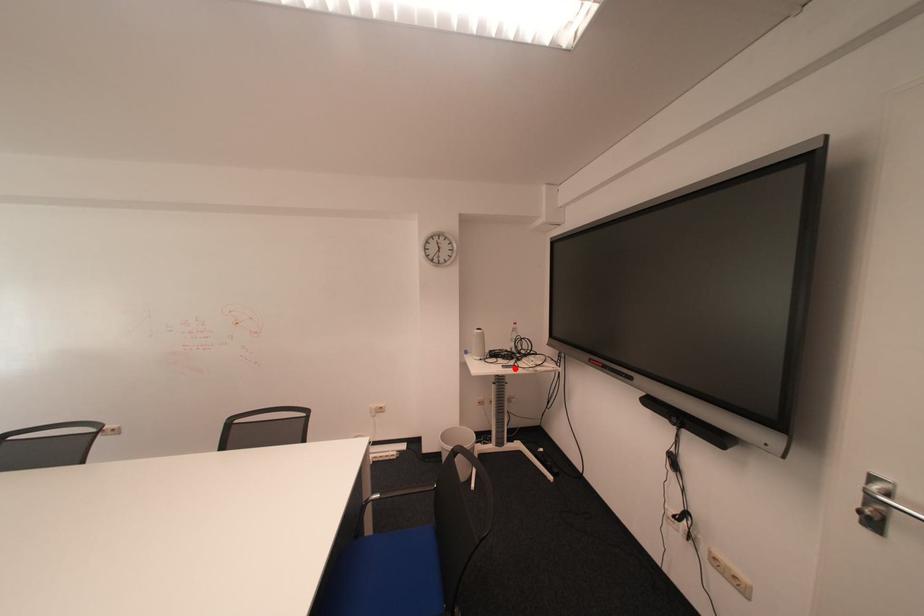
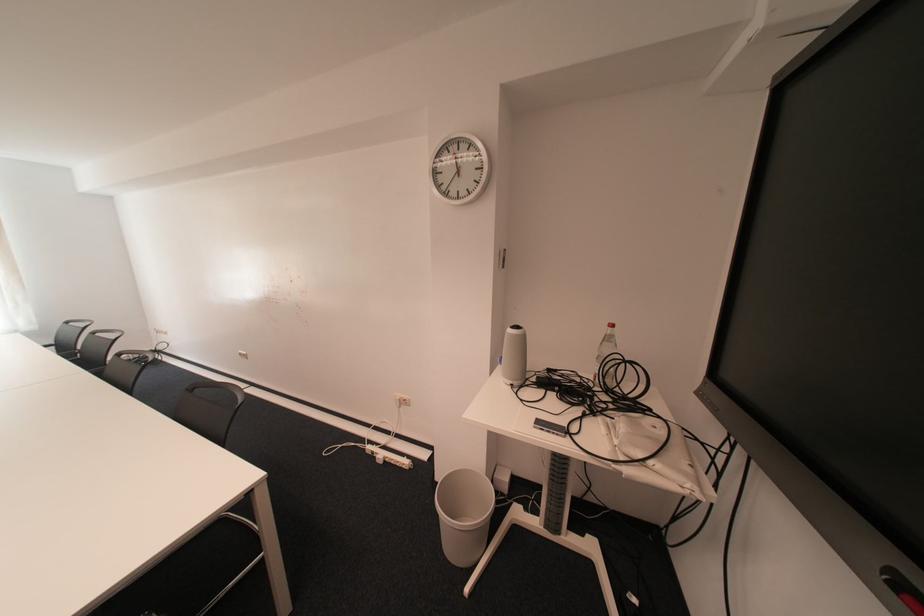
The point at the highlighted location is marked in the first image. Where is the corresponding point in the second image?

(545, 428)